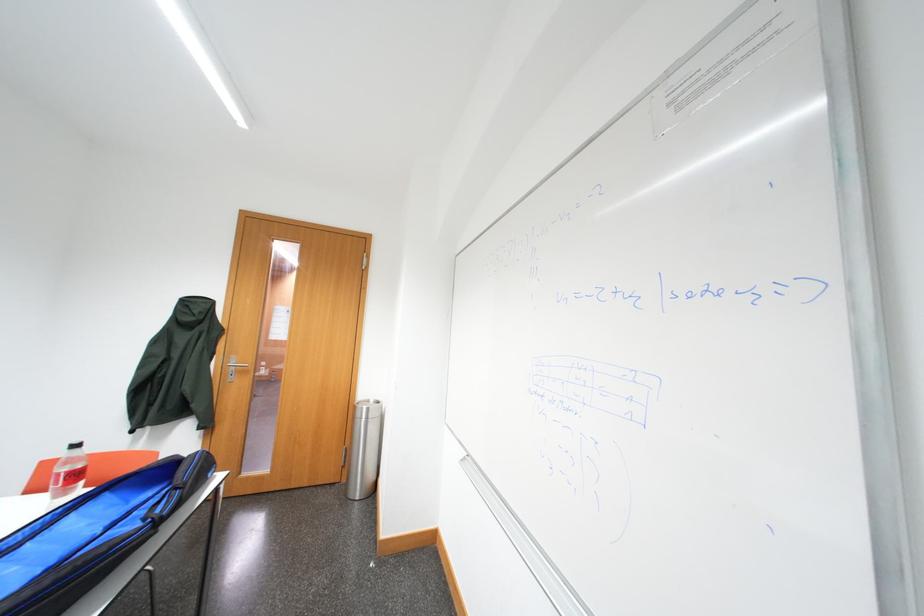
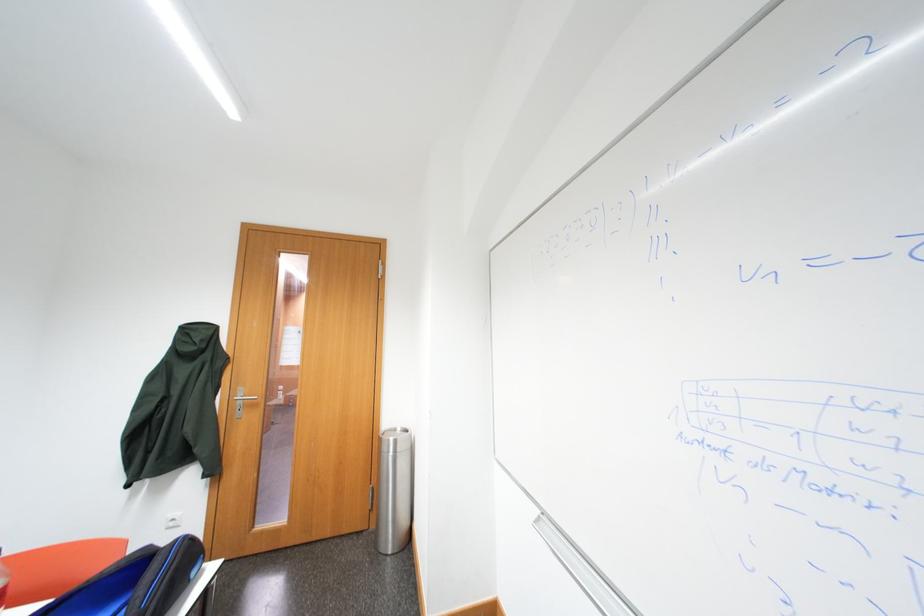
Question: The camera is either moving clockwise (left) or counter-clockwise (right) around the object. The first image is from the beginning of the video and the second image is from the end. Is the camera moving left or right when shooting the video?

Choices:
 (A) Left
 (B) Right

Answer: (B)